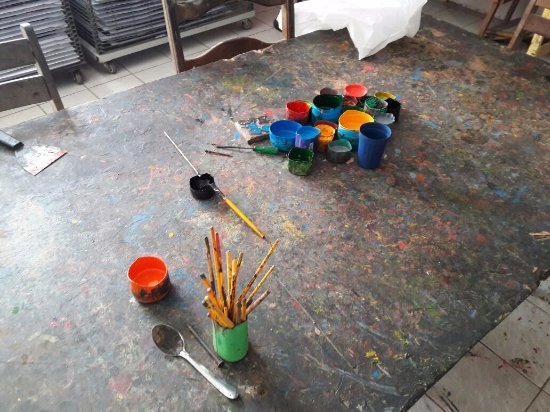
What are the coordinates of `red paint cup` in the screenshot? It's located at (158, 278).